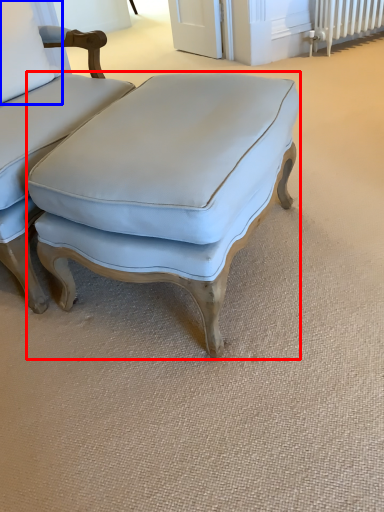
Question: Which object is closer to the camera taking this photo, studio couch (highlighted by a red box) or pillow (highlighted by a blue box)?

Choices:
 (A) studio couch
 (B) pillow

Answer: (A)